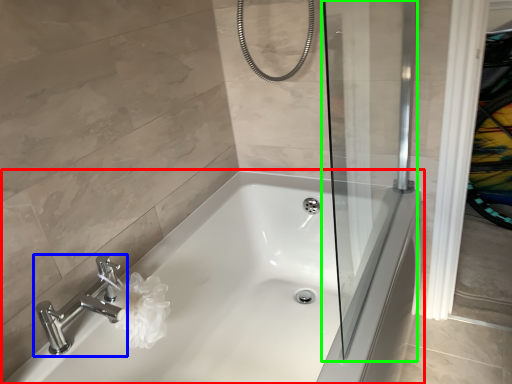
Question: Based on their relative distances, which object is farther from bathtub (highlighted by a red box)? Choose from tap (highlighted by a blue box) and screen door (highlighted by a green box).

Choices:
 (A) tap
 (B) screen door

Answer: (A)